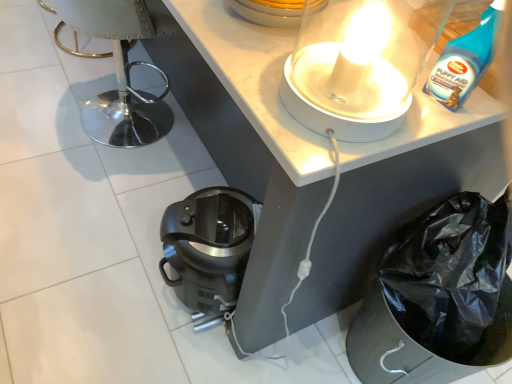
At what (x,y) coordinates should I click in order to perform the action: click on vacant area situated to the left side of black plastic coffee maker at lower center. Please return your answer as a coordinate pair (x, y). Image resolution: width=512 pixels, height=384 pixels. Looking at the image, I should click on (132, 273).